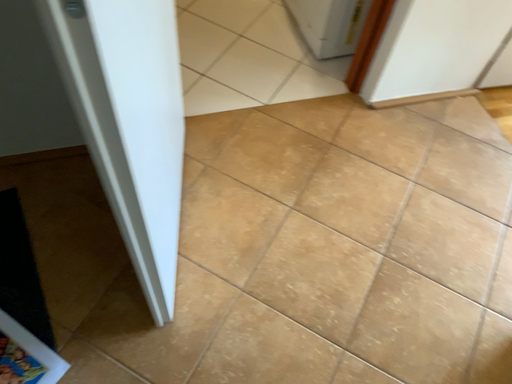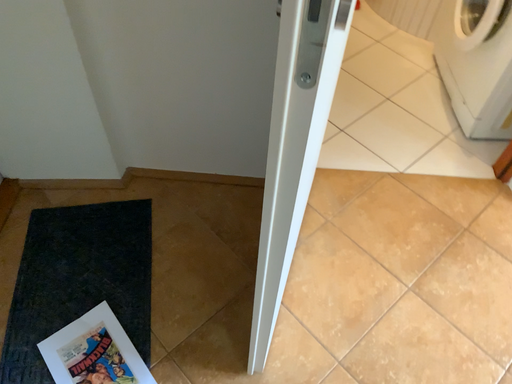
Question: How did the camera likely rotate when shooting the video?

Choices:
 (A) rotated downward
 (B) rotated upward

Answer: (B)